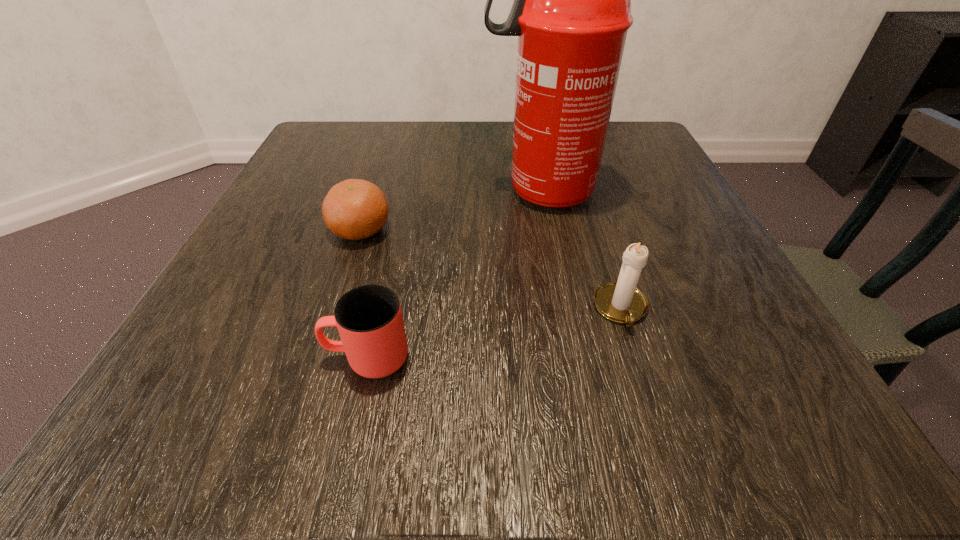
Select which object appears as the third closest to the fire extinguisher. Please provide its 2D coordinates. Your answer should be formatted as a tuple, i.e. [(x, y)], where the tuple contains the x and y coordinates of a point satisfying the conditions above.

[(369, 319)]

This screenshot has width=960, height=540. I want to click on vacant point that satisfies the following two spatial constraints: 1. on the trigger side of the fire extinguisher; 2. on the front side of the clementine, so click(547, 230).

At what (x,y) coordinates should I click in order to perform the action: click on vacant space that satisfies the following two spatial constraints: 1. on the handle side of the cup; 2. on the front side of the clementine. Please return your answer as a coordinate pair (x, y). The width and height of the screenshot is (960, 540). Looking at the image, I should click on (396, 230).